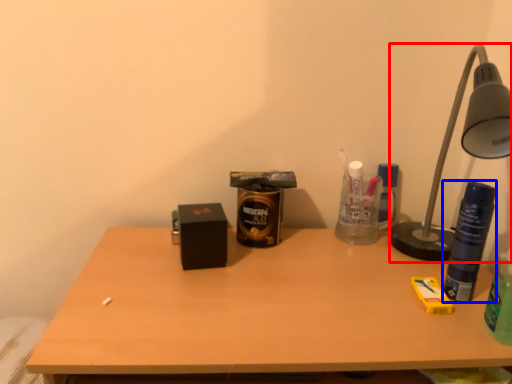
Question: Which of the following is the closest to the observer, lamp (highlighted by a red box) or beverage (highlighted by a blue box)?

Choices:
 (A) lamp
 (B) beverage

Answer: (A)